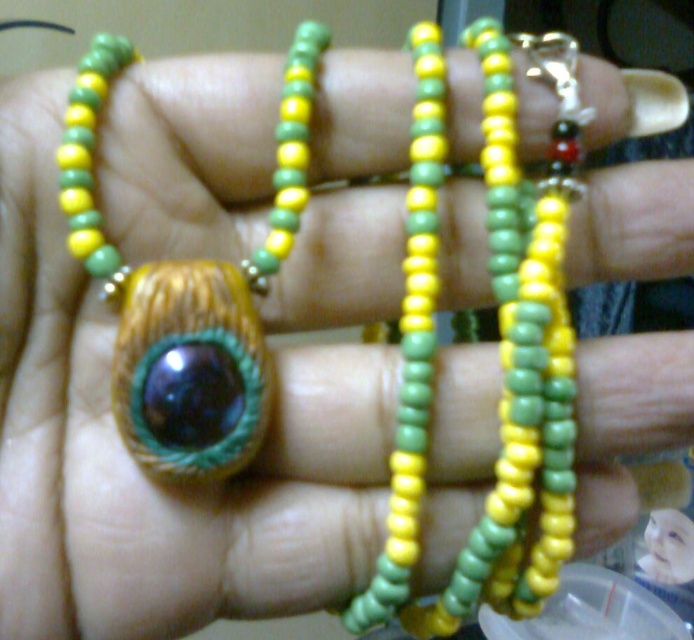
You are an observer looking at the bracelets. Which object is positioned to the left of the other between the matte plastic face at center and the matte brown eye at center?

The matte plastic face at center is positioned to the left of the matte brown eye at center.

You are an artist examining a closeup of a hand holding beaded bracelets. You notice two objects in the center of one bracelet. One is a matte plastic face at center and the other is a matte brown eye at center. Which of these two objects is larger?

The matte plastic face at center is bigger than the matte brown eye at center.